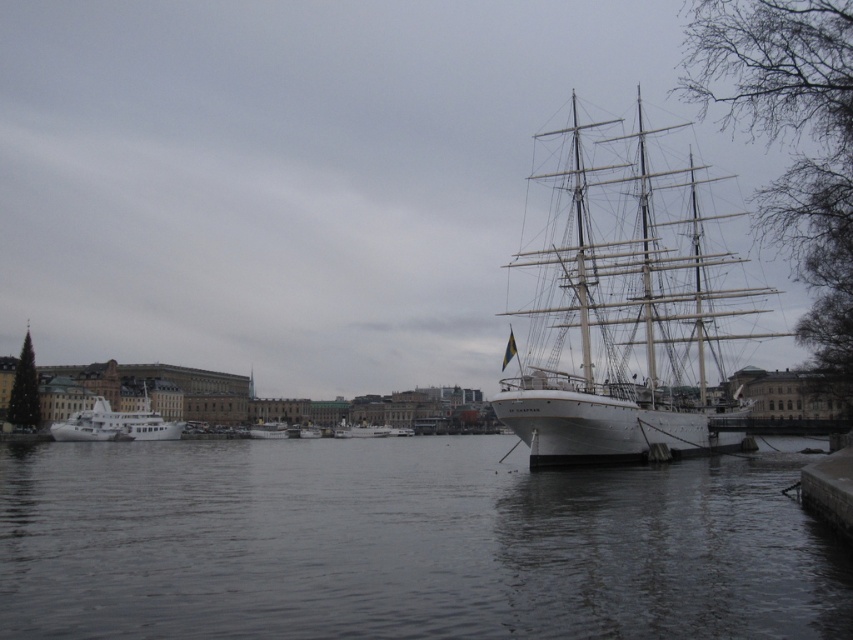
You are a photographer planning to capture a wide shot of the harbor scene. You want to ensure both the white glossy yacht at left and the white glossy boat at center are clearly visible in your photo. Given their sizes, which one should you focus on to ensure they both fit within the frame?

The white glossy yacht at left is larger in size than the white glossy boat at center, so you should focus on the white glossy yacht at left to ensure both fit within the frame.

You are a tourist standing on the pier and want to take a photo of the dark gray water at center and the white wooden boat at center. Which object should you point your camera upwards to capture?

You should point your camera upwards to capture the dark gray water at center because it is located above the white wooden boat at center.